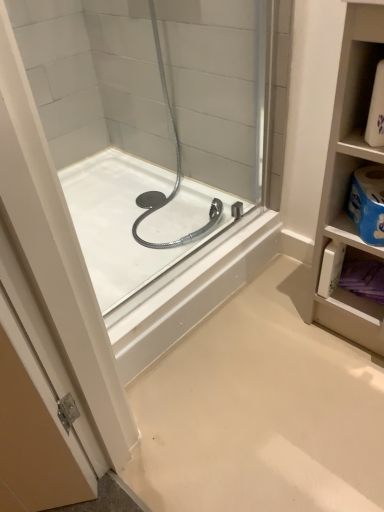
What is the approximate width of white glossy bathtub at center?

white glossy bathtub at center is 33.55 inches wide.

Measure the distance between white glossy bathtub at center and camera.

They are 3.44 feet apart.

Image resolution: width=384 pixels, height=512 pixels. Describe the element at coordinates (158, 253) in the screenshot. I see `white glossy bathtub at center` at that location.

I want to click on white glossy bathtub at center, so click(158, 253).

You are a GUI agent. You are given a task and a screenshot of the screen. Output one action in this format:
    pyautogui.click(x=<x>, y=<y>)
    Task: Click on the white plastic shelf at upper right
    The image size is (384, 512).
    Given the screenshot: What is the action you would take?
    pyautogui.click(x=357, y=92)

What do you see at coordinates (357, 92) in the screenshot?
I see `white plastic shelf at upper right` at bounding box center [357, 92].

This screenshot has width=384, height=512. I want to click on white glossy bathtub at center, so click(x=158, y=253).

Can you confirm if white glossy bathtub at center is positioned to the left of white plastic shelf at upper right?

Indeed, white glossy bathtub at center is positioned on the left side of white plastic shelf at upper right.

In the image, is white glossy bathtub at center positioned in front of or behind white plastic shelf at upper right?

white glossy bathtub at center is behind white plastic shelf at upper right.

Which is in front, point (104, 286) or point (362, 115)?

Positioned in front is point (362, 115).

From the image's perspective, is white glossy bathtub at center positioned above or below white plastic shelf at upper right?

Clearly, from the image's perspective, white glossy bathtub at center is below white plastic shelf at upper right.

From a real-world perspective, which is physically below, white glossy bathtub at center or white plastic shelf at upper right?

white glossy bathtub at center.

Considering the relative sizes of white glossy bathtub at center and white plastic shelf at upper right in the image provided, is white glossy bathtub at center thinner than white plastic shelf at upper right?

In fact, white glossy bathtub at center might be wider than white plastic shelf at upper right.

Which of these two, white glossy bathtub at center or white plastic shelf at upper right, stands taller?

white plastic shelf at upper right is taller.

Which of these two, white glossy bathtub at center or white plastic shelf at upper right, is bigger?

white glossy bathtub at center is bigger.

Does white glossy bathtub at center contain white plastic shelf at upper right?

Actually, white plastic shelf at upper right is outside white glossy bathtub at center.

Is white glossy bathtub at center directly adjacent to white plastic shelf at upper right?

They are not placed beside each other.

Is white plastic shelf at upper right at the back of white glossy bathtub at center?

No.

What's the angular difference between white glossy bathtub at center and white plastic shelf at upper right's facing directions?

There is a 87.5-degree angle between the facing directions of white glossy bathtub at center and white plastic shelf at upper right.

How far apart are white glossy bathtub at center and white plastic shelf at upper right?

The distance of white glossy bathtub at center from white plastic shelf at upper right is 27.29 inches.

At what (x,y) coordinates should I click in order to perform the action: click on bathtub located on the left of white plastic shelf at upper right. Please return your answer as a coordinate pair (x, y). Looking at the image, I should click on (158, 253).

Between white plastic shelf at upper right and white glossy bathtub at center, which one appears on the left side from the viewer's perspective?

Positioned to the left is white glossy bathtub at center.

Relative to white glossy bathtub at center, is white plastic shelf at upper right in front or behind?

In the image, white plastic shelf at upper right appears in front of white glossy bathtub at center.

Based on the photo, which is further, (363, 124) or (74, 168)?

The point (74, 168) is farther from the camera.

Consider the image. From the image's perspective, is white plastic shelf at upper right above or below white glossy bathtub at center?

white plastic shelf at upper right is above white glossy bathtub at center.

From a real-world perspective, who is located lower, white plastic shelf at upper right or white glossy bathtub at center?

white glossy bathtub at center is physically lower.

Considering the sizes of objects white plastic shelf at upper right and white glossy bathtub at center in the image provided, who is wider, white plastic shelf at upper right or white glossy bathtub at center?

white glossy bathtub at center is wider.

Does white plastic shelf at upper right have a greater height compared to white glossy bathtub at center?

Correct, white plastic shelf at upper right is much taller as white glossy bathtub at center.

Is white plastic shelf at upper right bigger or smaller than white glossy bathtub at center?

In the image, white plastic shelf at upper right appears to be smaller than white glossy bathtub at center.

In the scene shown: Is white glossy bathtub at center surrounded by white plastic shelf at upper right?

No, white plastic shelf at upper right does not contain white glossy bathtub at center.

Is white plastic shelf at upper right far away from white glossy bathtub at center?

No.

Is white plastic shelf at upper right looking in the opposite direction of white glossy bathtub at center?

No, white plastic shelf at upper right's orientation is not away from white glossy bathtub at center.

How different are the orientations of white plastic shelf at upper right and white glossy bathtub at center in degrees?

The facing directions of white plastic shelf at upper right and white glossy bathtub at center are 87.5 degrees apart.

This screenshot has width=384, height=512. Find the location of `bathtub that appears below the white plastic shelf at upper right (from the image's perspective)`. bathtub that appears below the white plastic shelf at upper right (from the image's perspective) is located at coordinates (158, 253).

Locate an element on the screen. shelf above the white glossy bathtub at center (from a real-world perspective) is located at coordinates (357, 92).

The image size is (384, 512). Identify the location of bathtub on the left of white plastic shelf at upper right. (158, 253).